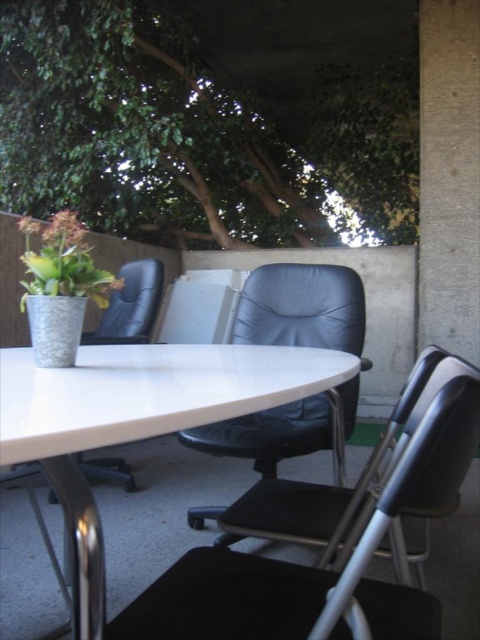
Can you confirm if green matte plant at upper left is smaller than matte black chair at center?

Yes, green matte plant at upper left is smaller than matte black chair at center.

Does green matte plant at upper left appear on the right side of matte black chair at center?

In fact, green matte plant at upper left is to the left of matte black chair at center.

Which is behind, point (59, 241) or point (137, 323)?

The point (137, 323) is behind.

Image resolution: width=480 pixels, height=640 pixels. In order to click on green matte plant at upper left in this screenshot , I will do `click(62, 260)`.

Between black leather chair at center and green matte plant at upper left, which one has more height?

black leather chair at center is taller.

Is black leather chair at center wider than green matte plant at upper left?

Indeed, black leather chair at center has a greater width compared to green matte plant at upper left.

Between point (298, 289) and point (66, 250), which one is positioned in front?

Positioned in front is point (66, 250).

Locate an element on the screen. black leather chair at center is located at coordinates (301, 307).

Between white glossy table at center and green matte plant at upper left, which one is positioned lower?

white glossy table at center is below.

Is white glossy table at center taller than green matte plant at upper left?

No.

Does point (79, 426) lie behind point (40, 260)?

No, it is not.

You are a GUI agent. You are given a task and a screenshot of the screen. Output one action in this format:
    pyautogui.click(x=<x>, y=<y>)
    Task: Click on the white glossy table at center
    The height and width of the screenshot is (640, 480).
    Given the screenshot: What is the action you would take?
    pyautogui.click(x=136, y=419)